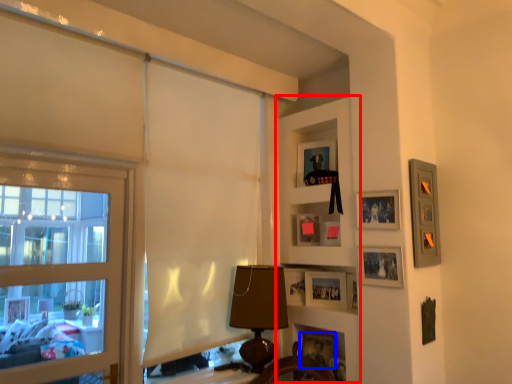
Question: Among these objects, which one is farthest to the camera, shelf (highlighted by a red box) or picture frame (highlighted by a blue box)?

Choices:
 (A) shelf
 (B) picture frame

Answer: (B)